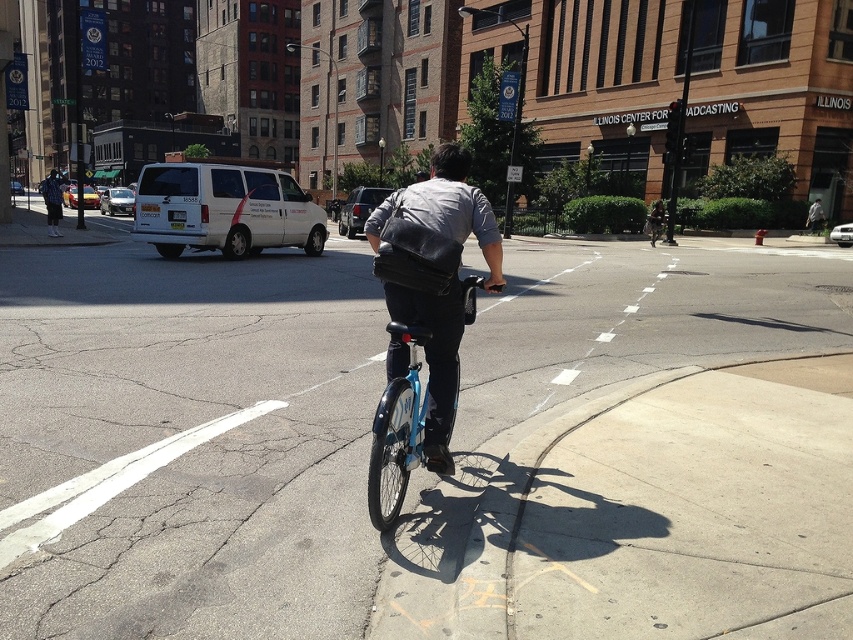
Is blue metallic bicycle at center above matte black bicycle at center?

No, blue metallic bicycle at center is not above matte black bicycle at center.

This screenshot has width=853, height=640. I want to click on blue metallic bicycle at center, so click(x=397, y=432).

Locate an element on the screen. The width and height of the screenshot is (853, 640). blue metallic bicycle at center is located at coordinates (397, 432).

Does white matte van at left have a smaller size compared to blue metallic bicycle at center?

Incorrect, white matte van at left is not smaller in size than blue metallic bicycle at center.

Who is more distant from viewer, [167,179] or [474,289]?

Point [167,179]

Which is in front, point (158, 179) or point (415, 444)?

Point (415, 444)

You are a GUI agent. You are given a task and a screenshot of the screen. Output one action in this format:
    pyautogui.click(x=<x>, y=<y>)
    Task: Click on the white matte van at left
    This screenshot has height=640, width=853.
    Given the screenshot: What is the action you would take?
    pyautogui.click(x=224, y=209)

Is white matte van at left above matte black bicycle at center?

Incorrect, white matte van at left is not positioned above matte black bicycle at center.

Locate an element on the screen. white matte van at left is located at coordinates tap(224, 209).